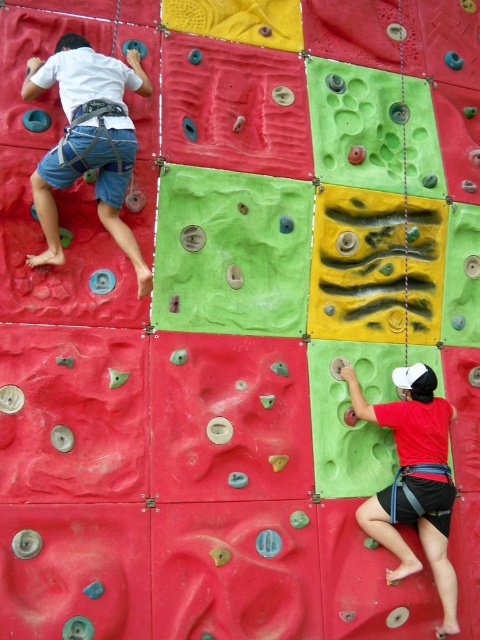
Question: Among these points, which one is farthest from the camera?

Choices:
 (A) (144, 289)
 (B) (404, 404)

Answer: (B)

Question: Is the position of matte white climbing harness at upper left more distant than that of matte red shorts at lower right?

Choices:
 (A) yes
 (B) no

Answer: (B)

Question: Does matte white climbing harness at upper left appear under matte red shorts at lower right?

Choices:
 (A) yes
 (B) no

Answer: (B)

Question: Considering the relative positions of matte white climbing harness at upper left and matte red shorts at lower right in the image provided, where is matte white climbing harness at upper left located with respect to matte red shorts at lower right?

Choices:
 (A) right
 (B) left

Answer: (B)